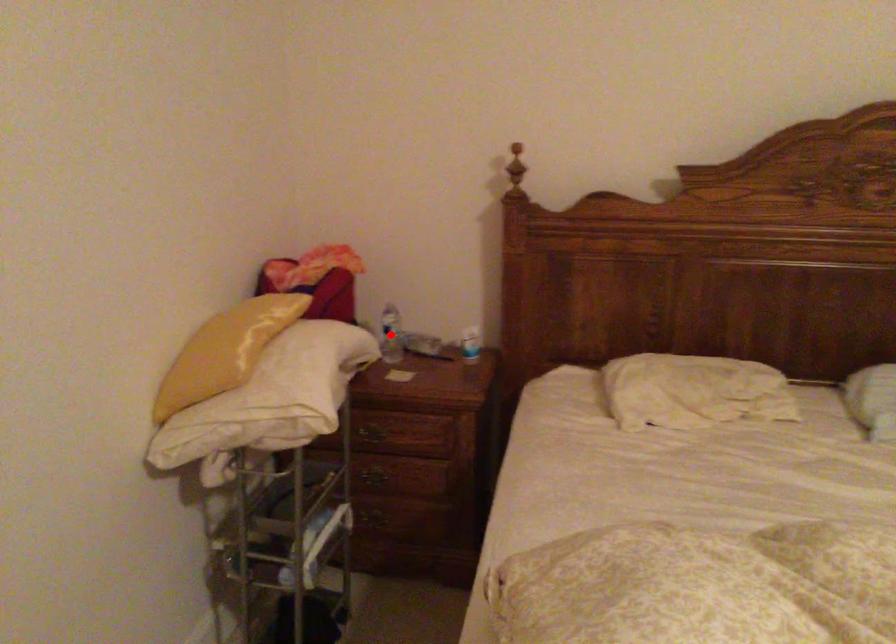
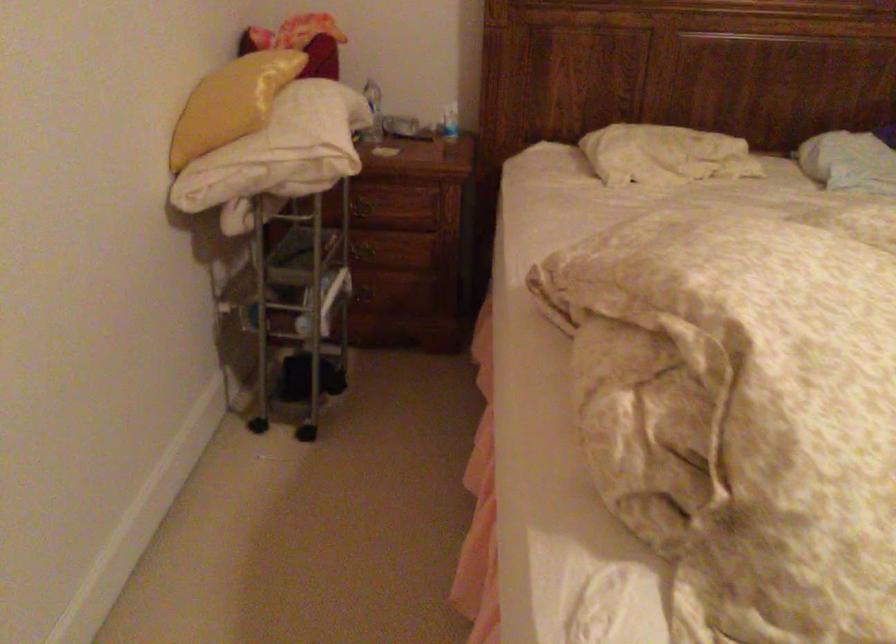
Question: I am providing you with two images of the same scene from different viewpoints. A red point is marked on the first image. Can you still see the location of the red point in image 2?

Choices:
 (A) Yes
 (B) No

Answer: (B)